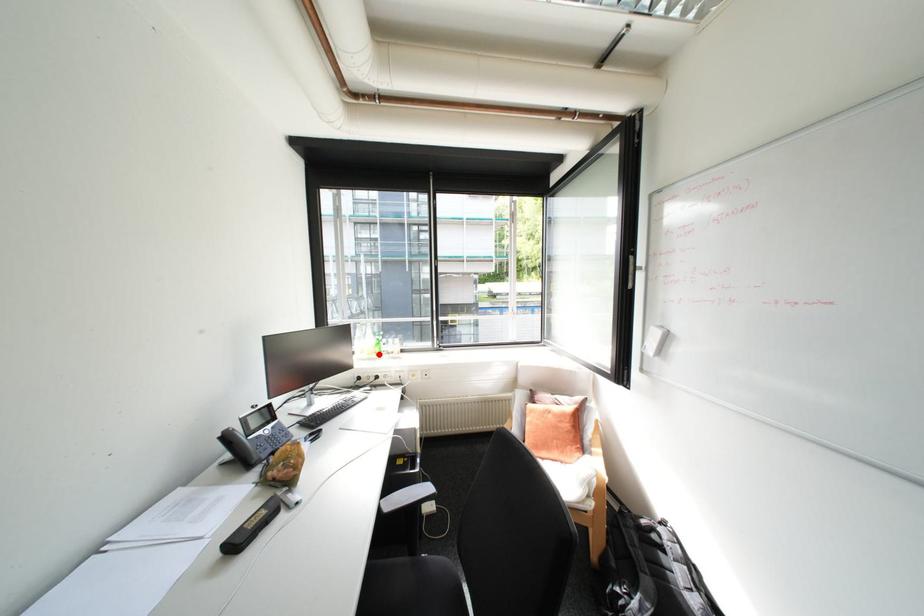
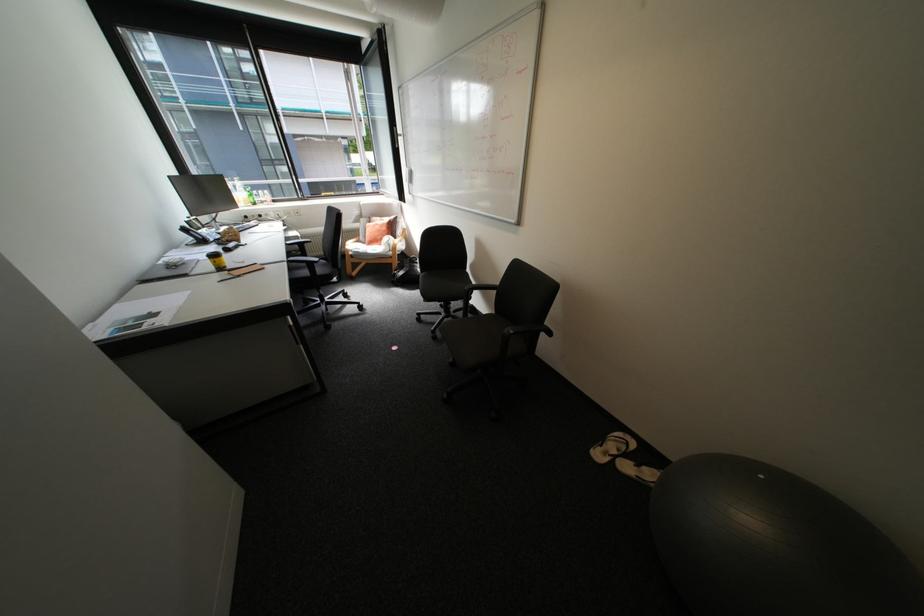
In the second image, find the point that corresponds to the highlighted location in the first image.

(256, 204)